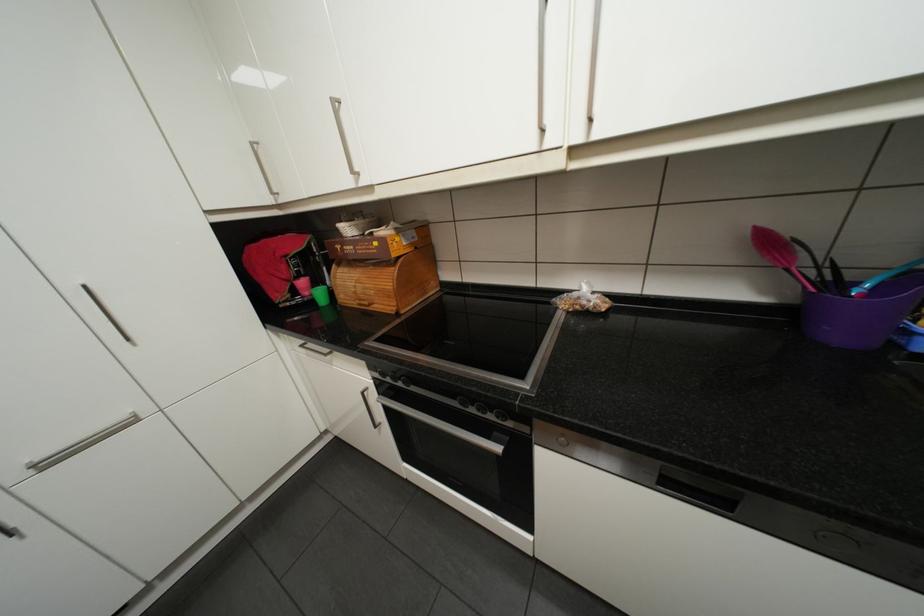
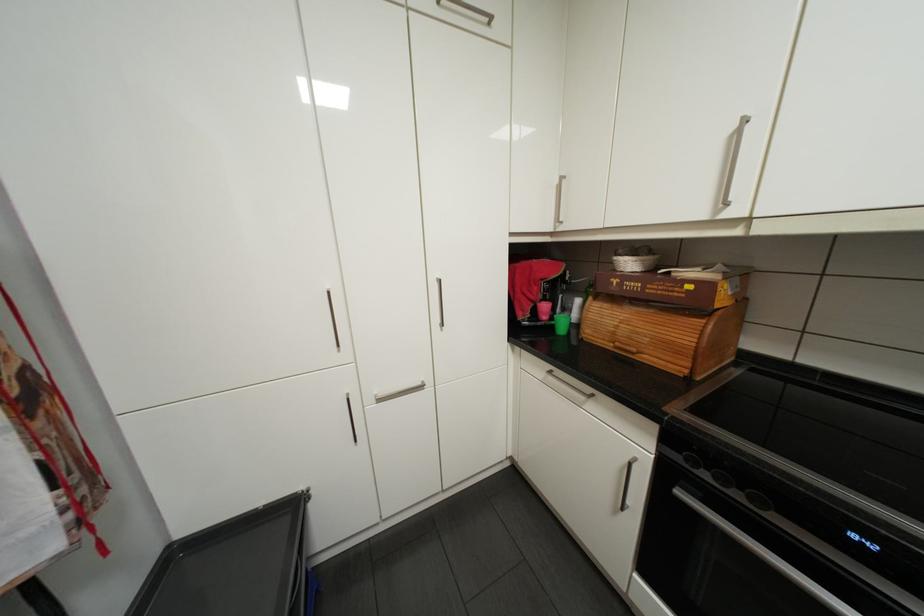
In the second image, find the point that corresponds to point 395,379 in the first image.

(712, 474)